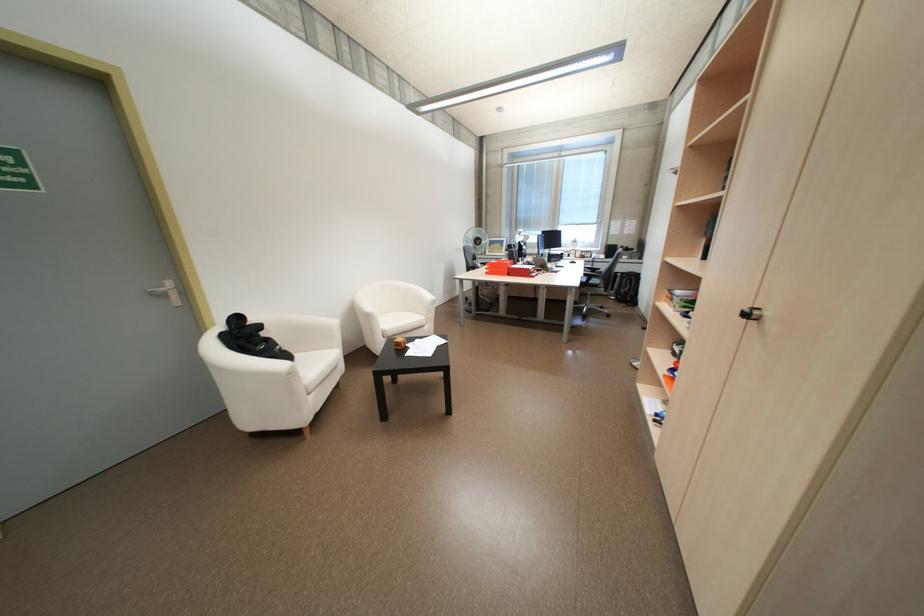
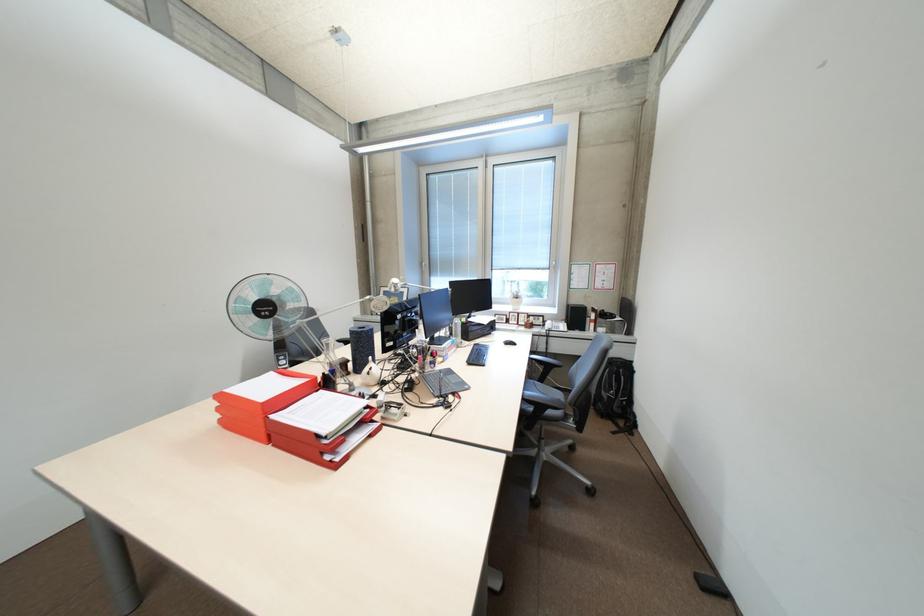
Where in the second image is the point corresponding to (496,272) from the first image?

(231, 421)